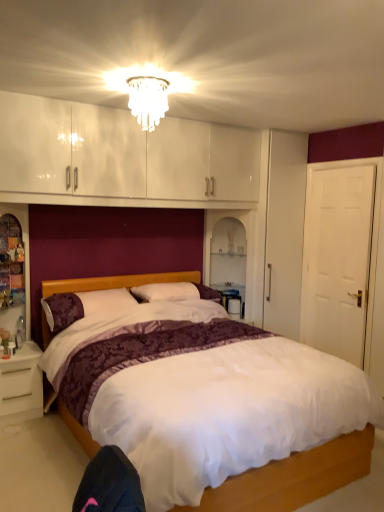
The width and height of the screenshot is (384, 512). Find the location of `translucent glass chandelier at upper center`. translucent glass chandelier at upper center is located at coordinates (148, 100).

I want to click on purple floral pillow at center, so click(x=83, y=306).

What are the coordinates of `white satin bed at center` in the screenshot? It's located at (294, 477).

What do you see at coordinates (294, 477) in the screenshot? I see `white satin bed at center` at bounding box center [294, 477].

Identify the location of white matte door at right. (338, 259).

Locate an element on the screen. white glossy nightstand at lower left is located at coordinates (21, 385).

What do you see at coordinates (21, 385) in the screenshot? The width and height of the screenshot is (384, 512). I see `white glossy nightstand at lower left` at bounding box center [21, 385].

Image resolution: width=384 pixels, height=512 pixels. What do you see at coordinates (232, 288) in the screenshot? I see `white glossy table at right` at bounding box center [232, 288].

Where is `translucent glass chandelier at upper center`? The width and height of the screenshot is (384, 512). translucent glass chandelier at upper center is located at coordinates (148, 100).

How many degrees apart are the facing directions of white glossy table at right and white satin bed at center?

The angular difference between white glossy table at right and white satin bed at center is 2.76 degrees.

Is white glossy table at right facing towards white satin bed at center?

No, white glossy table at right is not oriented towards white satin bed at center.

Is white glossy table at right far away from white satin bed at center?

Yes, white glossy table at right is far from white satin bed at center.

Locate an element on the screen. The image size is (384, 512). bed lying on the left of white glossy table at right is located at coordinates (294, 477).

Is white matte door at right bigger or smaller than purple floral pillow at center?

white matte door at right is bigger than purple floral pillow at center.

Considering the positions of objects white matte door at right and purple floral pillow at center in the image provided, who is more to the left, white matte door at right or purple floral pillow at center?

Positioned to the left is purple floral pillow at center.

Are white matte door at right and purple floral pillow at center located far from each other?

Absolutely, white matte door at right is distant from purple floral pillow at center.

Do you think white matte door at right is within purple floral pillow at center, or outside of it?

white matte door at right is not inside purple floral pillow at center, it's outside.

Is translucent glass chandelier at upper center bigger or smaller than white glossy nightstand at lower left?

translucent glass chandelier at upper center is smaller than white glossy nightstand at lower left.

Is translucent glass chandelier at upper center further to the viewer compared to white glossy nightstand at lower left?

No, it is in front of white glossy nightstand at lower left.

Considering the relative sizes of translucent glass chandelier at upper center and white glossy nightstand at lower left in the image provided, is translucent glass chandelier at upper center taller than white glossy nightstand at lower left?

In fact, translucent glass chandelier at upper center may be shorter than white glossy nightstand at lower left.

Is translucent glass chandelier at upper center next to white glossy nightstand at lower left?

translucent glass chandelier at upper center and white glossy nightstand at lower left are clearly separated.

Is purple floral pillow at center smaller than white glossy nightstand at lower left?

Actually, purple floral pillow at center might be larger than white glossy nightstand at lower left.

From the image's perspective, which one is positioned lower, purple floral pillow at center or white glossy nightstand at lower left?

white glossy nightstand at lower left appears lower in the image.

Is point (74, 305) positioned in front of point (34, 401)?

No, (74, 305) is behind (34, 401).

Considering the relative positions of purple floral pillow at center and white glossy nightstand at lower left in the image provided, is purple floral pillow at center to the left of white glossy nightstand at lower left from the viewer's perspective?

No.

Considering the positions of objects white satin bed at center and white glossy table at right in the image provided, who is more to the left, white satin bed at center or white glossy table at right?

white satin bed at center.

Which object is wider, white satin bed at center or white glossy table at right?

white satin bed at center.

Is white satin bed at center further to camera compared to white glossy table at right?

That is False.

Which of these two, white satin bed at center or white glossy table at right, is smaller?

With smaller size is white glossy table at right.

Is translucent glass chandelier at upper center aimed at white glossy table at right?

No, translucent glass chandelier at upper center is not oriented towards white glossy table at right.

Based on the photo, from the image's perspective, is translucent glass chandelier at upper center located beneath white glossy table at right?

Incorrect, from the image's perspective, translucent glass chandelier at upper center is higher than white glossy table at right.

Can you tell me how much translucent glass chandelier at upper center and white glossy table at right differ in facing direction?

They differ by 3.98 degrees in their facing directions.

Is point (69, 305) closer or farther from the camera than point (52, 281)?

Point (69, 305).

The image size is (384, 512). Find the location of `bed below the purple floral pillow at center (from a real-world perspective)`. bed below the purple floral pillow at center (from a real-world perspective) is located at coordinates (294, 477).

From the image's perspective, which is below, purple floral pillow at center or white satin bed at center?

white satin bed at center, from the image's perspective.

Where is `bed in front of the white glossy table at right`? Image resolution: width=384 pixels, height=512 pixels. bed in front of the white glossy table at right is located at coordinates (294, 477).

Locate an element on the screen. Image resolution: width=384 pixels, height=512 pixels. pillow lying on the left of white matte door at right is located at coordinates [x=83, y=306].

From the image, which object appears to be farther from white glossy nightstand at lower left, white satin bed at center or purple floral pillow at center?

The object further to white glossy nightstand at lower left is white satin bed at center.

Looking at the image, which one is located closer to white glossy table at right, translucent glass chandelier at upper center or white matte door at right?

white matte door at right is positioned closer to the anchor white glossy table at right.

Estimate the real-world distances between objects in this image. Which object is closer to white satin bed at center, white glossy nightstand at lower left or purple floral pillow at center?

purple floral pillow at center is closer to white satin bed at center.

When comparing their distances from white glossy table at right, does white matte door at right or white glossy nightstand at lower left seem closer?

The object closer to white glossy table at right is white matte door at right.

Looking at the image, which one is located further to white matte door at right, white satin bed at center or translucent glass chandelier at upper center?

Based on the image, translucent glass chandelier at upper center appears to be further to white matte door at right.

Looking at this image, when comparing their distances from purple floral pillow at center, does white matte door at right or white glossy table at right seem closer?

white glossy table at right is closer to purple floral pillow at center.

Based on their spatial positions, is white glossy table at right or purple floral pillow at center further from white glossy nightstand at lower left?

white glossy table at right lies further to white glossy nightstand at lower left than the other object.

Estimate the real-world distances between objects in this image. Which object is closer to translucent glass chandelier at upper center, white matte door at right or white glossy nightstand at lower left?

Based on the image, white matte door at right appears to be nearer to translucent glass chandelier at upper center.

Where is `nightstand between white satin bed at center and white glossy table at right along the z-axis`? The image size is (384, 512). nightstand between white satin bed at center and white glossy table at right along the z-axis is located at coordinates (21, 385).

The image size is (384, 512). I want to click on table between white glossy nightstand at lower left and white matte door at right, so click(x=232, y=288).

Where is `bed located between purple floral pillow at center and white matte door at right in the left-right direction`? bed located between purple floral pillow at center and white matte door at right in the left-right direction is located at coordinates (294, 477).

Image resolution: width=384 pixels, height=512 pixels. Find the location of `pillow between white glossy nightstand at lower left and white matte door at right from left to right`. pillow between white glossy nightstand at lower left and white matte door at right from left to right is located at coordinates (83, 306).